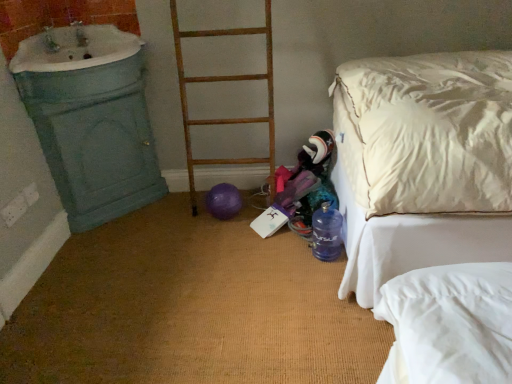
Question: From a real-world perspective, is rusty wood ladder at center on white porcelain sink at upper left?

Choices:
 (A) yes
 (B) no

Answer: (B)

Question: Is rusty wood ladder at center facing towards white porcelain sink at upper left?

Choices:
 (A) no
 (B) yes

Answer: (A)

Question: Is rusty wood ladder at center touching white porcelain sink at upper left?

Choices:
 (A) no
 (B) yes

Answer: (A)

Question: Does rusty wood ladder at center have a lesser width compared to white porcelain sink at upper left?

Choices:
 (A) no
 (B) yes

Answer: (B)

Question: Is rusty wood ladder at center at the right side of white porcelain sink at upper left?

Choices:
 (A) no
 (B) yes

Answer: (B)

Question: Is rusty wood ladder at center positioned in front of white porcelain sink at upper left?

Choices:
 (A) no
 (B) yes

Answer: (A)

Question: Does translucent blue bottle at lower right touch white satin bed at right?

Choices:
 (A) yes
 (B) no

Answer: (B)

Question: Can you confirm if translucent blue bottle at lower right is positioned to the right of white satin bed at right?

Choices:
 (A) no
 (B) yes

Answer: (A)

Question: Does translucent blue bottle at lower right appear on the left side of white satin bed at right?

Choices:
 (A) yes
 (B) no

Answer: (A)

Question: Can you confirm if translucent blue bottle at lower right is shorter than white satin bed at right?

Choices:
 (A) yes
 (B) no

Answer: (A)

Question: Does translucent blue bottle at lower right have a lesser width compared to white satin bed at right?

Choices:
 (A) no
 (B) yes

Answer: (B)

Question: From a real-world perspective, is translucent blue bottle at lower right below white satin bed at right?

Choices:
 (A) yes
 (B) no

Answer: (A)

Question: Is white porcelain sink at upper left closer to camera compared to white satin bed at right?

Choices:
 (A) yes
 (B) no

Answer: (B)